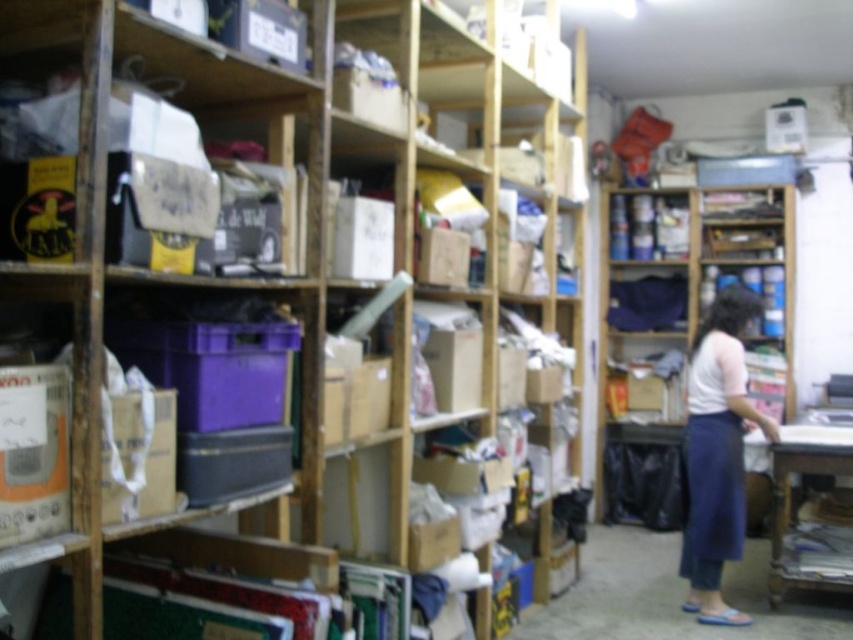
Does point (432, 28) come in front of point (699, 369)?

Yes, it is in front of point (699, 369).

What do you see at coordinates (306, 147) in the screenshot?
I see `wooden shelves at center` at bounding box center [306, 147].

Which is behind, point (260, 99) or point (692, 579)?

The point (692, 579) is more distant.

This screenshot has width=853, height=640. Identify the location of wooden shelves at center. (306, 147).

Is wooden bookshelf at center wider than blue denim apron at lower right?

Indeed, wooden bookshelf at center has a greater width compared to blue denim apron at lower right.

Does point (788, 332) come closer to viewer compared to point (700, 531)?

No, (788, 332) is behind (700, 531).

What do you see at coordinates (654, 278) in the screenshot? I see `wooden bookshelf at center` at bounding box center [654, 278].

You are a GUI agent. You are given a task and a screenshot of the screen. Output one action in this format:
    pyautogui.click(x=<x>, y=<y>)
    Task: Click on the wooden bookshelf at center
    
    Given the screenshot: What is the action you would take?
    pyautogui.click(x=654, y=278)

Measure the distance between wooden shelves at center and blue denim apron at lower right.

wooden shelves at center is 1.53 meters away from blue denim apron at lower right.

Can you confirm if wooden shelves at center is bigger than blue denim apron at lower right?

Indeed, wooden shelves at center has a larger size compared to blue denim apron at lower right.

Which is behind, point (399, 472) or point (724, 499)?

Positioned behind is point (724, 499).

In order to click on wooden shelves at center in this screenshot , I will do `click(306, 147)`.